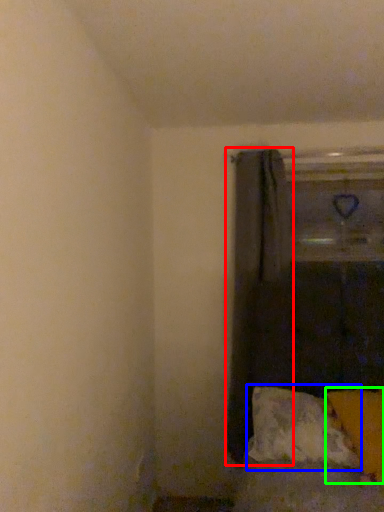
Question: Which object is the closest to the curtain (highlighted by a red box)? Choose among these: pillow (highlighted by a blue box) or pillow (highlighted by a green box).

Choices:
 (A) pillow
 (B) pillow

Answer: (A)